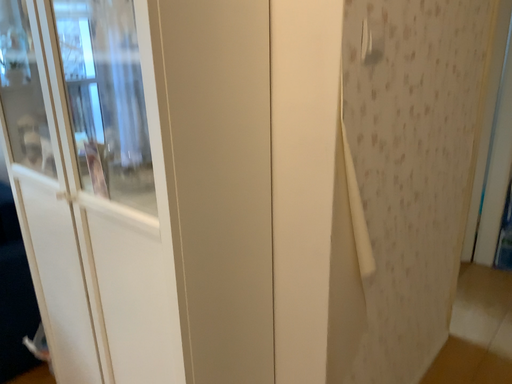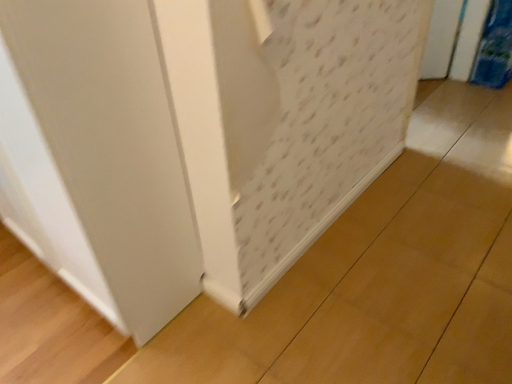
Question: Which way did the camera rotate in the video?

Choices:
 (A) rotated downward
 (B) rotated upward

Answer: (A)